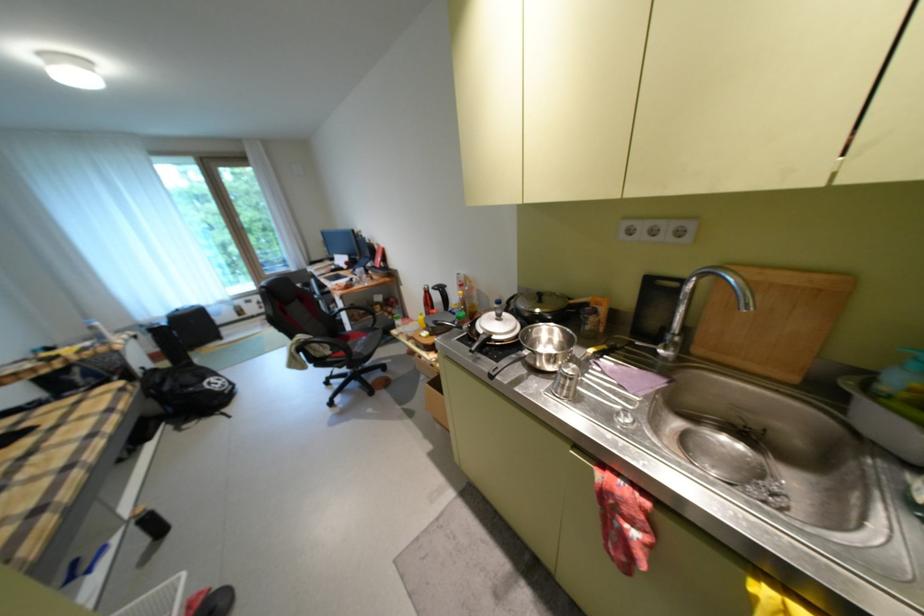
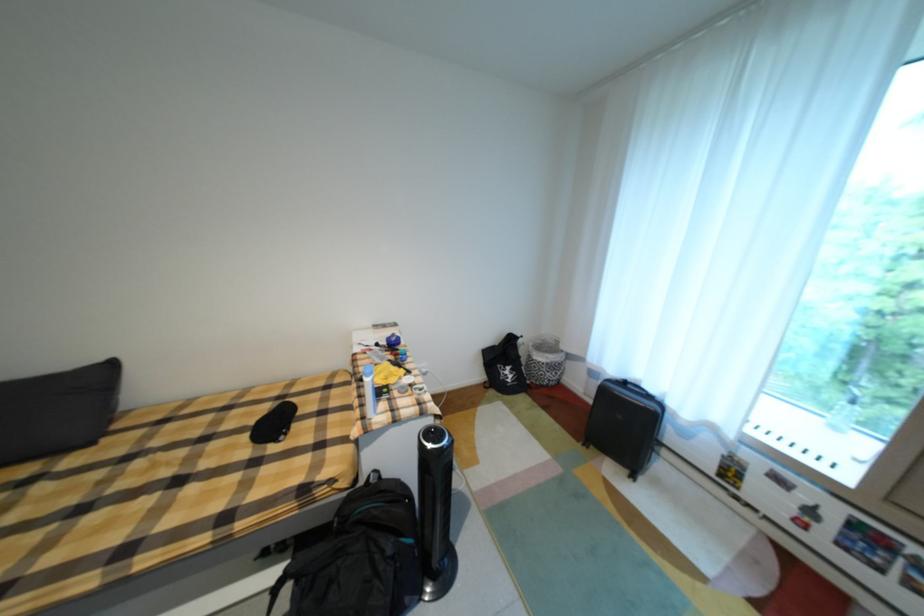
Find the pixel in the second image that matches point (188, 310) in the first image.

(635, 384)